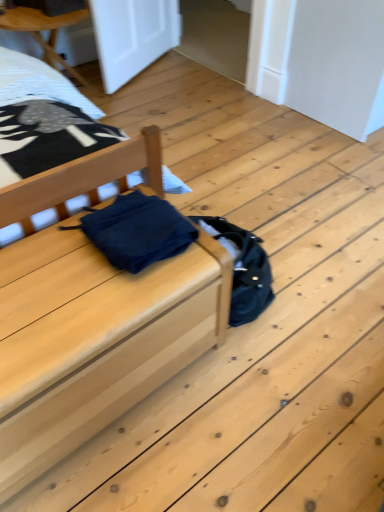
Question: Would you say dark blue fabric at center contains white textured sheet at upper left?

Choices:
 (A) no
 (B) yes

Answer: (A)

Question: Is dark blue fabric at center directly adjacent to white textured sheet at upper left?

Choices:
 (A) yes
 (B) no

Answer: (B)

Question: Does dark blue fabric at center have a greater height compared to white textured sheet at upper left?

Choices:
 (A) yes
 (B) no

Answer: (B)

Question: From the image's perspective, is dark blue fabric at center beneath white textured sheet at upper left?

Choices:
 (A) yes
 (B) no

Answer: (A)

Question: Is dark blue fabric at center thinner than white textured sheet at upper left?

Choices:
 (A) no
 (B) yes

Answer: (B)

Question: Is dark blue fabric at center to the left of white textured sheet at upper left from the viewer's perspective?

Choices:
 (A) no
 (B) yes

Answer: (A)

Question: Is white textured sheet at upper left shorter than matte blue fabric at center?

Choices:
 (A) yes
 (B) no

Answer: (A)

Question: Is white textured sheet at upper left thinner than matte blue fabric at center?

Choices:
 (A) yes
 (B) no

Answer: (A)

Question: Considering the relative sizes of white textured sheet at upper left and matte blue fabric at center in the image provided, is white textured sheet at upper left bigger than matte blue fabric at center?

Choices:
 (A) no
 (B) yes

Answer: (A)

Question: Can you confirm if white textured sheet at upper left is taller than matte blue fabric at center?

Choices:
 (A) yes
 (B) no

Answer: (B)

Question: Is white textured sheet at upper left behind matte blue fabric at center?

Choices:
 (A) yes
 (B) no

Answer: (A)

Question: Is white textured sheet at upper left to the left of matte blue fabric at center from the viewer's perspective?

Choices:
 (A) yes
 (B) no

Answer: (A)

Question: Considering the relative sizes of dark blue fabric at center and matte wood bed at center in the image provided, is dark blue fabric at center smaller than matte wood bed at center?

Choices:
 (A) no
 (B) yes

Answer: (B)